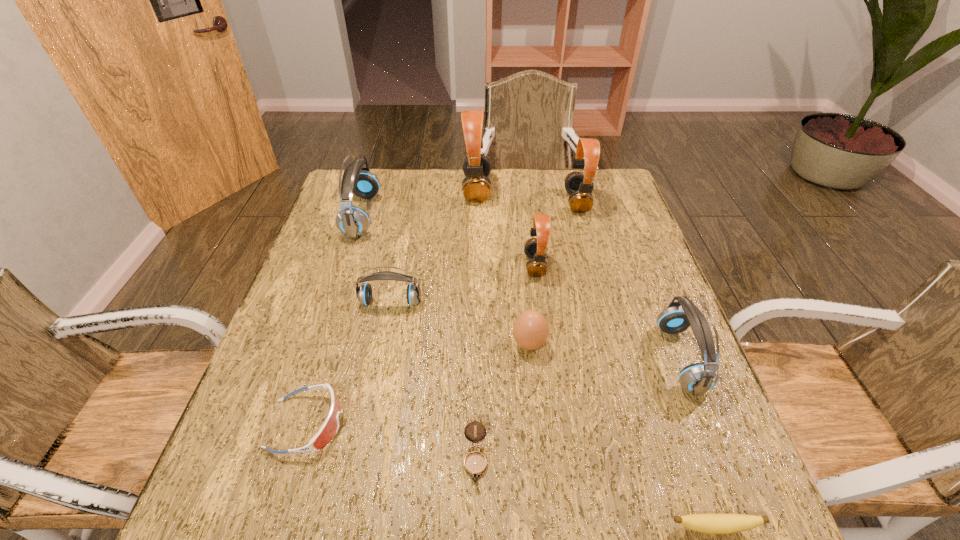
Find the location of a particular element. vacant area that satisfies the following two spatial constraints: 1. on the ear cups of the boiled egg; 2. on the right side of the farthest blue headset is located at coordinates (321, 344).

Find the location of a particular element. The width and height of the screenshot is (960, 540). free space that satisfies the following two spatial constraints: 1. on the ear cups of the shortest object; 2. on the right side of the second blue headset from right to left is located at coordinates (347, 527).

This screenshot has height=540, width=960. Find the location of `blank space that satisfies the following two spatial constraints: 1. on the ear cups of the second smallest blue headset; 2. on the face of the compass`. blank space that satisfies the following two spatial constraints: 1. on the ear cups of the second smallest blue headset; 2. on the face of the compass is located at coordinates (720, 460).

Locate an element on the screen. vacant space that satisfies the following two spatial constraints: 1. on the ear cups of the tallest headset; 2. on the right side of the boiled egg is located at coordinates (475, 344).

Where is `blank area in the image that satisfies the following two spatial constraints: 1. on the front side of the yellow banana; 2. on the left side of the boiled egg`? The height and width of the screenshot is (540, 960). blank area in the image that satisfies the following two spatial constraints: 1. on the front side of the yellow banana; 2. on the left side of the boiled egg is located at coordinates (547, 527).